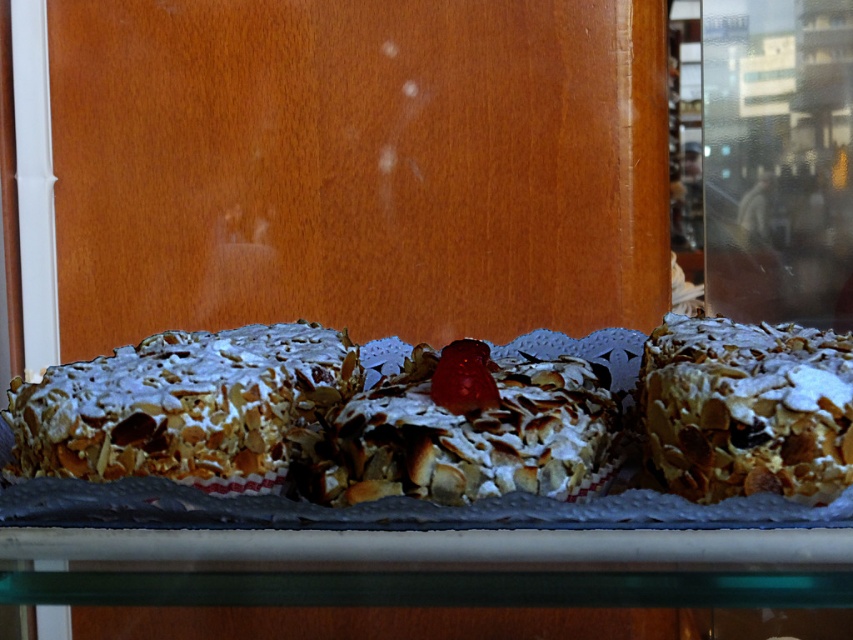
Question: Is powdered almond cake at left wider than powdered almond cake at center?

Choices:
 (A) no
 (B) yes

Answer: (B)

Question: Among these objects, which one is farthest from the camera?

Choices:
 (A) powdered almond cake at center
 (B) powdery white almond cake at right

Answer: (A)

Question: Which of these objects is positioned closest to the powdered almond cake at left?

Choices:
 (A) powdered almond cake at center
 (B) powdery white almond cake at right

Answer: (A)

Question: Considering the relative positions of powdered almond cake at left and powdery white almond cake at right in the image provided, where is powdered almond cake at left located with respect to powdery white almond cake at right?

Choices:
 (A) right
 (B) left

Answer: (B)

Question: Which point is closer to the camera?

Choices:
 (A) (573, 364)
 (B) (738, 332)
 (C) (142, 420)

Answer: (C)

Question: Does powdered almond cake at center appear over powdery white almond cake at right?

Choices:
 (A) no
 (B) yes

Answer: (B)